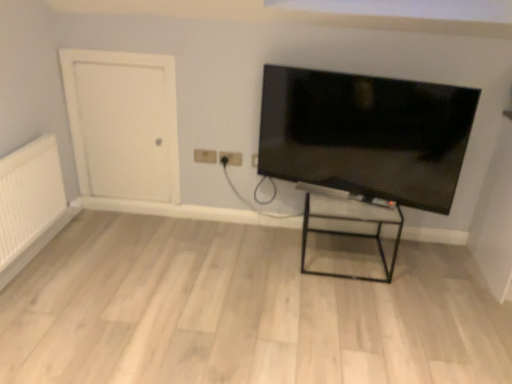
Question: Which direction should I rotate to look at matte plastic outlet at upper center, the 1th electric outlet when ordered from right to left, — up or down?

Choices:
 (A) up
 (B) down

Answer: (A)

Question: Can you confirm if transparent glass table at center is smaller than beige plastic electric outlet at center, placed as the first electric outlet when sorted from left to right?

Choices:
 (A) yes
 (B) no

Answer: (B)

Question: Does transparent glass table at center have a greater width compared to beige plastic electric outlet at center, which appears as the 2th electric outlet when viewed from the right?

Choices:
 (A) yes
 (B) no

Answer: (A)

Question: Is transparent glass table at center closer to camera compared to beige plastic electric outlet at center, placed as the first electric outlet when sorted from left to right?

Choices:
 (A) no
 (B) yes

Answer: (B)

Question: Is transparent glass table at center not within beige plastic electric outlet at center, placed as the first electric outlet when sorted from left to right?

Choices:
 (A) yes
 (B) no

Answer: (A)

Question: Does transparent glass table at center have a lesser height compared to beige plastic electric outlet at center, which appears as the 2th electric outlet when viewed from the right?

Choices:
 (A) yes
 (B) no

Answer: (B)

Question: Considering the relative sizes of transparent glass table at center and beige plastic electric outlet at center, which appears as the 2th electric outlet when viewed from the right, in the image provided, is transparent glass table at center taller than beige plastic electric outlet at center, which appears as the 2th electric outlet when viewed from the right,?

Choices:
 (A) yes
 (B) no

Answer: (A)

Question: From a real-world perspective, is white matte door at left beneath matte plastic outlet at upper center, the 2th electric outlet viewed from the left?

Choices:
 (A) yes
 (B) no

Answer: (B)

Question: Is white matte door at left not close to matte plastic outlet at upper center, the 1th electric outlet when ordered from right to left?

Choices:
 (A) no
 (B) yes

Answer: (A)

Question: Is white matte door at left positioned with its back to matte plastic outlet at upper center, the 2th electric outlet viewed from the left?

Choices:
 (A) yes
 (B) no

Answer: (B)

Question: Is white matte door at left thinner than matte plastic outlet at upper center, the 2th electric outlet viewed from the left?

Choices:
 (A) yes
 (B) no

Answer: (B)

Question: Does white matte door at left have a larger size compared to matte plastic outlet at upper center, the 1th electric outlet when ordered from right to left?

Choices:
 (A) yes
 (B) no

Answer: (A)

Question: From a real-world perspective, is white matte door at left on top of matte plastic outlet at upper center, the 2th electric outlet viewed from the left?

Choices:
 (A) yes
 (B) no

Answer: (A)

Question: Does matte plastic outlet at upper center, the 1th electric outlet when ordered from right to left, appear on the right side of white textured radiator at left?

Choices:
 (A) no
 (B) yes

Answer: (B)